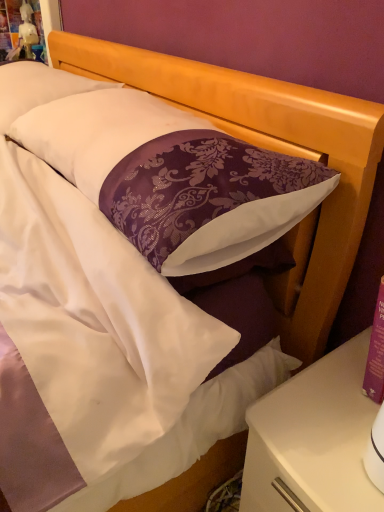
Identify the location of purple damask pillow at center, the first pillow positioned from the front. Image resolution: width=384 pixels, height=512 pixels. (173, 177).

Based on the photo, what is the approximate width of white satin pillow at upper left, positioned as the first pillow in back-to-front order?

white satin pillow at upper left, positioned as the first pillow in back-to-front order, is 15.54 inches wide.

This screenshot has width=384, height=512. What are the coordinates of `purple damask pillow at center, the first pillow positioned from the front` in the screenshot? It's located at (173, 177).

Can you confirm if white glossy nightstand at lower right is thinner than purple damask pillow at center, the first pillow positioned from the front?

In fact, white glossy nightstand at lower right might be wider than purple damask pillow at center, the first pillow positioned from the front.

Locate an element on the screen. pillow in front of the white glossy nightstand at lower right is located at coordinates (173, 177).

Between white glossy nightstand at lower right and purple damask pillow at center, arranged as the 2th pillow when viewed from the back, which one is positioned behind?

white glossy nightstand at lower right is more distant.

Is white glossy nightstand at lower right not near purple damask pillow at center, arranged as the 2th pillow when viewed from the back?

white glossy nightstand at lower right is actually quite close to purple damask pillow at center, arranged as the 2th pillow when viewed from the back.

Who is smaller, purple damask pillow at center, arranged as the 2th pillow when viewed from the back, or white glossy nightstand at lower right?

With smaller size is white glossy nightstand at lower right.

Which object is closer to the camera, purple damask pillow at center, arranged as the 2th pillow when viewed from the back, or white glossy nightstand at lower right?

Positioned in front is purple damask pillow at center, arranged as the 2th pillow when viewed from the back.

Measure the distance between purple damask pillow at center, arranged as the 2th pillow when viewed from the back, and white glossy nightstand at lower right.

43.87 centimeters.

Which is more to the right, purple damask pillow at center, arranged as the 2th pillow when viewed from the back, or white glossy nightstand at lower right?

white glossy nightstand at lower right.

From a real-world perspective, is white satin pillow at upper left, positioned as the first pillow in back-to-front order, below white glossy nightstand at lower right?

Incorrect, from a real-world perspective, white satin pillow at upper left, positioned as the first pillow in back-to-front order, is higher than white glossy nightstand at lower right.

Is white satin pillow at upper left, which appears as the second pillow when viewed from the front, with white glossy nightstand at lower right?

white satin pillow at upper left, which appears as the second pillow when viewed from the front, and white glossy nightstand at lower right are clearly separated.

There is a white glossy nightstand at lower right. Identify the location of the 2nd pillow above it (from the image's perspective). (37, 88).

Is white glossy nightstand at lower right wider than white satin pillow at upper left, which appears as the second pillow when viewed from the front?

Correct, the width of white glossy nightstand at lower right exceeds that of white satin pillow at upper left, which appears as the second pillow when viewed from the front.

Is point (330, 411) closer or farther from the camera than point (35, 100)?

Clearly, point (330, 411) is closer to the camera than point (35, 100).

Would you say white glossy nightstand at lower right is a long distance from white satin pillow at upper left, positioned as the first pillow in back-to-front order?

No, white glossy nightstand at lower right is not far from white satin pillow at upper left, positioned as the first pillow in back-to-front order.

Would you say white glossy nightstand at lower right contains white satin pillow at upper left, positioned as the first pillow in back-to-front order?

Actually, white satin pillow at upper left, positioned as the first pillow in back-to-front order, is outside white glossy nightstand at lower right.

From the image's perspective, relative to purple damask pillow at center, the first pillow positioned from the front, is white satin pillow at upper left, which appears as the second pillow when viewed from the front, above or below?

Based on their image positions, white satin pillow at upper left, which appears as the second pillow when viewed from the front, is located above purple damask pillow at center, the first pillow positioned from the front.

Between white satin pillow at upper left, positioned as the first pillow in back-to-front order, and purple damask pillow at center, the first pillow positioned from the front, which one has less height?

purple damask pillow at center, the first pillow positioned from the front.

Would you say purple damask pillow at center, the first pillow positioned from the front, is part of white satin pillow at upper left, positioned as the first pillow in back-to-front order,'s contents?

No, purple damask pillow at center, the first pillow positioned from the front, is not inside white satin pillow at upper left, positioned as the first pillow in back-to-front order.

Is white satin pillow at upper left, positioned as the first pillow in back-to-front order, touching purple damask pillow at center, arranged as the 2th pillow when viewed from the back?

They are not placed beside each other.

Can you tell me how much purple damask pillow at center, arranged as the 2th pillow when viewed from the back, and white satin pillow at upper left, which appears as the second pillow when viewed from the front, differ in facing direction?

purple damask pillow at center, arranged as the 2th pillow when viewed from the back, and white satin pillow at upper left, which appears as the second pillow when viewed from the front, are facing 0.354 degrees away from each other.

Where is `pillow in front of the white satin pillow at upper left, which appears as the second pillow when viewed from the front`? This screenshot has width=384, height=512. pillow in front of the white satin pillow at upper left, which appears as the second pillow when viewed from the front is located at coordinates (173, 177).

Is purple damask pillow at center, arranged as the 2th pillow when viewed from the back, outside of white satin pillow at upper left, positioned as the first pillow in back-to-front order?

Yes, purple damask pillow at center, arranged as the 2th pillow when viewed from the back, is located beyond the bounds of white satin pillow at upper left, positioned as the first pillow in back-to-front order.

Between purple damask pillow at center, arranged as the 2th pillow when viewed from the back, and white satin pillow at upper left, positioned as the first pillow in back-to-front order, which one is positioned in front?

purple damask pillow at center, arranged as the 2th pillow when viewed from the back, is more forward.

The height and width of the screenshot is (512, 384). I want to click on the 1st pillow to the left when counting from the white glossy nightstand at lower right, so click(173, 177).

Where is `nightstand on the right of purple damask pillow at center, the first pillow positioned from the front`? nightstand on the right of purple damask pillow at center, the first pillow positioned from the front is located at coordinates (313, 439).

From the image, which object appears to be nearer to white glossy nightstand at lower right, purple damask pillow at center, the first pillow positioned from the front, or white satin pillow at upper left, positioned as the first pillow in back-to-front order?

purple damask pillow at center, the first pillow positioned from the front, lies closer to white glossy nightstand at lower right than the other object.

Estimate the real-world distances between objects in this image. Which object is closer to purple damask pillow at center, arranged as the 2th pillow when viewed from the back, white satin pillow at upper left, positioned as the first pillow in back-to-front order, or white glossy nightstand at lower right?

The object closer to purple damask pillow at center, arranged as the 2th pillow when viewed from the back, is white satin pillow at upper left, positioned as the first pillow in back-to-front order.

Estimate the real-world distances between objects in this image. Which object is closer to purple damask pillow at center, arranged as the 2th pillow when viewed from the back, white glossy nightstand at lower right or white satin pillow at upper left, positioned as the first pillow in back-to-front order?

Based on the image, white satin pillow at upper left, positioned as the first pillow in back-to-front order, appears to be nearer to purple damask pillow at center, arranged as the 2th pillow when viewed from the back.

From the image, which object appears to be farther from white glossy nightstand at lower right, white satin pillow at upper left, which appears as the second pillow when viewed from the front, or purple damask pillow at center, the first pillow positioned from the front?

white satin pillow at upper left, which appears as the second pillow when viewed from the front, is positioned further to the anchor white glossy nightstand at lower right.

Based on the photo, based on their spatial positions, is white glossy nightstand at lower right or purple damask pillow at center, the first pillow positioned from the front, closer to white satin pillow at upper left, positioned as the first pillow in back-to-front order?

purple damask pillow at center, the first pillow positioned from the front, is positioned closer to the anchor white satin pillow at upper left, positioned as the first pillow in back-to-front order.

Estimate the real-world distances between objects in this image. Which object is closer to white satin pillow at upper left, positioned as the first pillow in back-to-front order, purple damask pillow at center, arranged as the 2th pillow when viewed from the back, or white glossy nightstand at lower right?

purple damask pillow at center, arranged as the 2th pillow when viewed from the back, lies closer to white satin pillow at upper left, positioned as the first pillow in back-to-front order, than the other object.

Identify the location of pillow between white satin pillow at upper left, which appears as the second pillow when viewed from the front, and white glossy nightstand at lower right vertically. tap(173, 177).